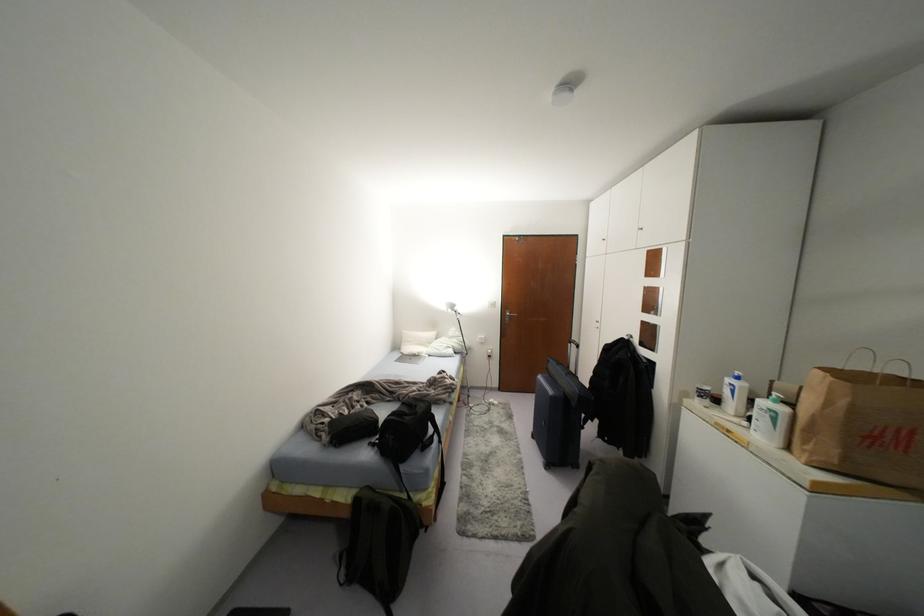
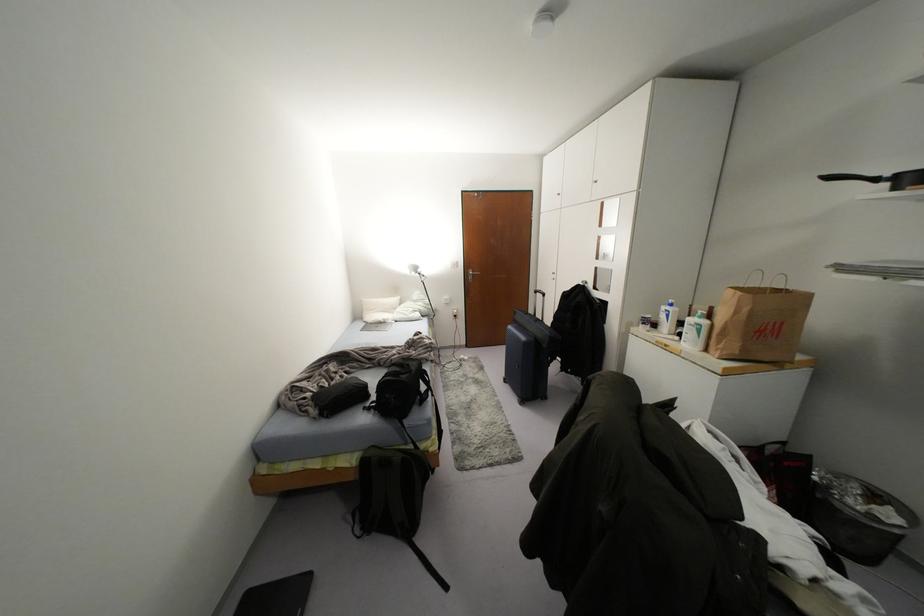
The point at (492,304) is marked in the first image. Where is the corresponding point in the second image?

(456, 264)